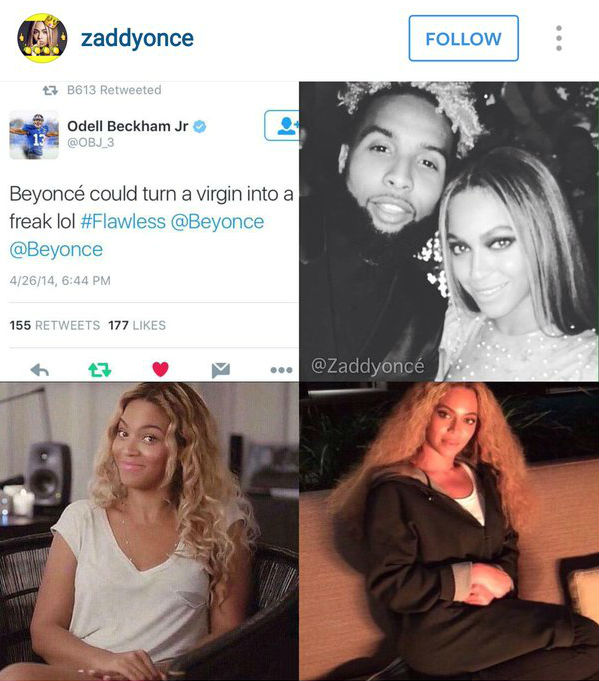
Identify the location of chair. (265, 624).